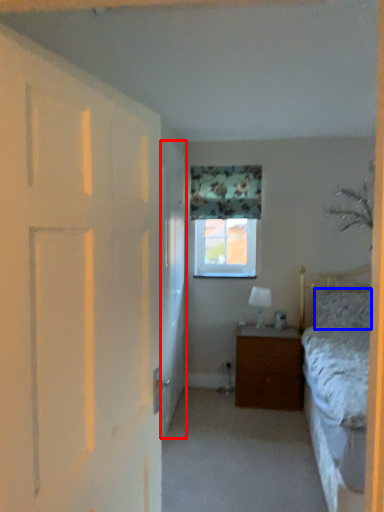
Question: Which of the following is the farthest to the observer, screen door (highlighted by a red box) or pillow (highlighted by a blue box)?

Choices:
 (A) screen door
 (B) pillow

Answer: (B)